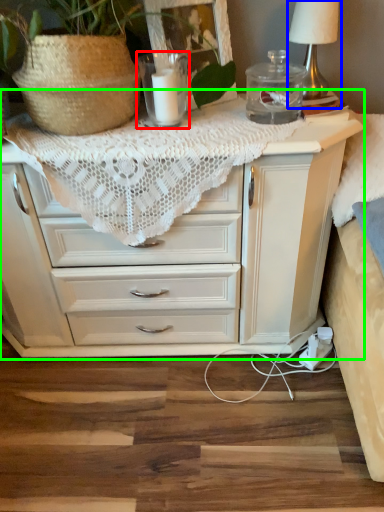
Question: Estimate the real-world distances between objects in this image. Which object is farther from candle holder (highlighted by a red box), table lamp (highlighted by a blue box) or chest of drawers (highlighted by a green box)?

Choices:
 (A) table lamp
 (B) chest of drawers

Answer: (B)